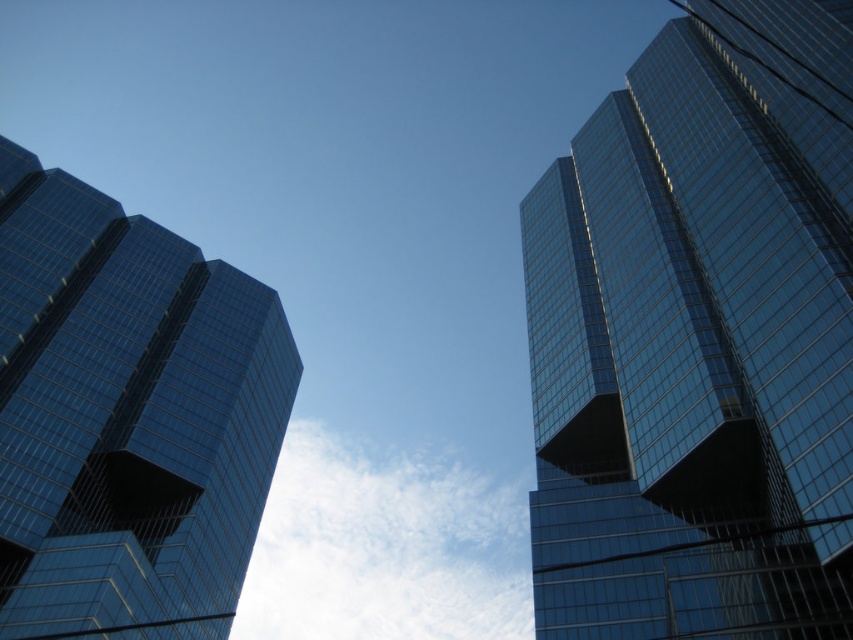
Measure the distance between point (596, 308) and camera.

Point (596, 308) is 89.99 meters away from camera.

Is glossy glass skyscraper at upper right to the left of shiny glass building at left from the viewer's perspective?

No, glossy glass skyscraper at upper right is not to the left of shiny glass building at left.

Who is more distant from viewer, (822, 236) or (114, 355)?

Point (114, 355)

At what (x,y) coordinates should I click in order to perform the action: click on glossy glass skyscraper at upper right. Please return your answer as a coordinate pair (x, y). Image resolution: width=853 pixels, height=640 pixels. Looking at the image, I should click on (699, 339).